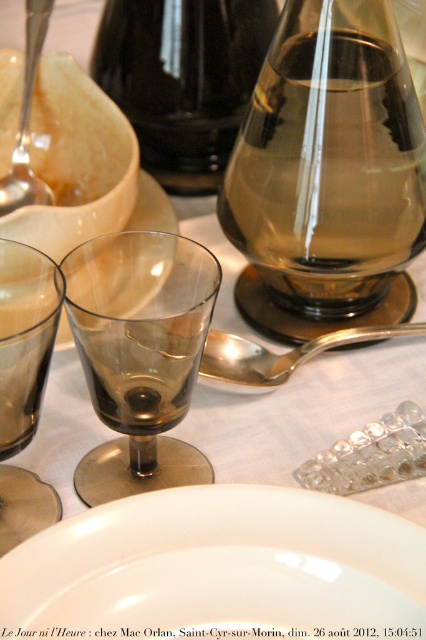
You are setting up a table for two guests. You have a brown glass at center and a metallic spoon at upper left. Which object is shorter in height?

The brown glass at center is shorter in height than the metallic spoon at upper left.

You are a server arranging glasses on a table. You have an amber glass wine glass at center and a brown glass at center. According to the scene, which glass is positioned higher up?

The amber glass wine glass at center is above the brown glass at center, so it is positioned higher up.

You are looking at a table setting and want to place a napkin between the two points marked as point (74, 244) and point (20, 202). Which point should the napkin be closer to in order to be nearer to the viewer?

The napkin should be closer to point (74, 244) because it is closer to the viewer than point (20, 202).